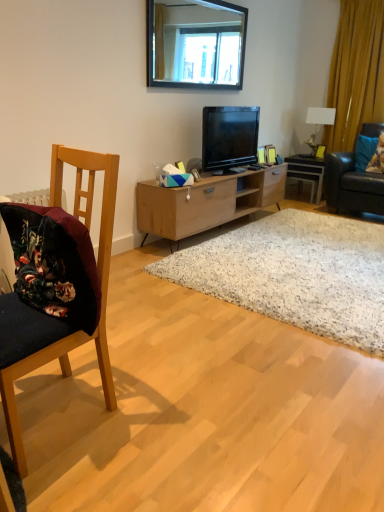
Describe the element at coordinates (295, 273) in the screenshot. The image size is (384, 512). I see `white speckled rug at center` at that location.

What do you see at coordinates (196, 44) in the screenshot? I see `black glass mirror at upper center` at bounding box center [196, 44].

What do you see at coordinates (377, 157) in the screenshot?
I see `blue fabric pillow at right, which is the 1th pillow in right-to-left order` at bounding box center [377, 157].

What do you see at coordinates (356, 72) in the screenshot?
I see `yellow fabric curtain at right` at bounding box center [356, 72].

Locate an element on the screen. The width and height of the screenshot is (384, 512). white speckled rug at center is located at coordinates [x=295, y=273].

From a real-world perspective, is light wood cabinet at center positioned above or below white speckled rug at center?

light wood cabinet at center is above white speckled rug at center.

Who is taller, light wood cabinet at center or white speckled rug at center?

Standing taller between the two is light wood cabinet at center.

From the image's perspective, is light wood cabinet at center above or below white speckled rug at center?

Based on their image positions, light wood cabinet at center is located above white speckled rug at center.

Is light wood cabinet at center facing away from white speckled rug at center?

light wood cabinet at center does not have its back to white speckled rug at center.

Does point (329, 281) lie in front of point (272, 153)?

Yes, it is.

Which of these two, white speckled rug at center or wooden picture frame at upper center, stands taller?

A: wooden picture frame at upper center.

Looking at this image, does white speckled rug at center touch wooden picture frame at upper center?

No, white speckled rug at center is not with wooden picture frame at upper center.

Can you tell me how much wooden picture frame at upper center and black leather couch at right differ in facing direction?

The facing directions of wooden picture frame at upper center and black leather couch at right are 66.4 degrees apart.

Which of these two, wooden picture frame at upper center or black leather couch at right, stands taller?

black leather couch at right is taller.

Between wooden picture frame at upper center and black leather couch at right, which one has larger width?

black leather couch at right is wider.

From the picture: In terms of width, does black glossy television at center look wider or thinner when compared to white speckled rug at center?

Clearly, black glossy television at center has less width compared to white speckled rug at center.

Based on their positions, is black glossy television at center located to the left or right of white speckled rug at center?

From the image, it's evident that black glossy television at center is to the left of white speckled rug at center.

How distant is black glossy television at center from white speckled rug at center?

A distance of 1.06 meters exists between black glossy television at center and white speckled rug at center.

In the scene shown: From a real-world perspective, is black glossy television at center positioned under white speckled rug at center based on gravity?

Incorrect, from a real-world perspective, black glossy television at center is higher than white speckled rug at center.

In the scene shown: From a real-world perspective, who is located higher, black glass mirror at upper center or blue fabric pillow at right, which is the 1th pillow in right-to-left order?

black glass mirror at upper center.

Between black glass mirror at upper center and blue fabric pillow at right, which is the 1th pillow in right-to-left order, which one has larger width?

With larger width is blue fabric pillow at right, which is the 1th pillow in right-to-left order.

Does black glass mirror at upper center turn towards blue fabric pillow at right, acting as the second pillow starting from the left?

No, black glass mirror at upper center is not aimed at blue fabric pillow at right, acting as the second pillow starting from the left.

From the image's perspective, is white speckled rug at center located beneath light wood cabinet at center?

Yes, from the image's perspective, white speckled rug at center is beneath light wood cabinet at center.

Can you confirm if white speckled rug at center is thinner than light wood cabinet at center?

In fact, white speckled rug at center might be wider than light wood cabinet at center.

How different are the orientations of white speckled rug at center and light wood cabinet at center in degrees?

The facing directions of white speckled rug at center and light wood cabinet at center are 89.7 degrees apart.

Is point (207, 250) more distant than point (141, 221)?

That is False.

From the picture: Could blue fabric pillow at right, placed as the 1th pillow when sorted from left to right, be considered to be inside black leather couch at right?

Yes, black leather couch at right is surrounding blue fabric pillow at right, placed as the 1th pillow when sorted from left to right.

From the image's perspective, which one is positioned lower, black leather couch at right or blue fabric pillow at right, the 2th pillow viewed from the right?

From the image's view, black leather couch at right is below.

Does black leather couch at right touch blue fabric pillow at right, placed as the 1th pillow when sorted from left to right?

No, black leather couch at right is not making contact with blue fabric pillow at right, placed as the 1th pillow when sorted from left to right.

From a real-world perspective, who is located lower, black leather couch at right or blue fabric pillow at right, the 2th pillow viewed from the right?

In real-world perspective, black leather couch at right is lower.

What are the coordinates of `plain in front of the light wood cabinet at center` in the screenshot? It's located at (295, 273).

Find the location of a particular element. This screenshot has width=384, height=512. plain below the wooden picture frame at upper center (from a real-world perspective) is located at coordinates (295, 273).

Looking at the image, which one is located closer to wooden desk at center, white speckled rug at center or yellow fabric curtain at right?

yellow fabric curtain at right lies closer to wooden desk at center than the other object.

Considering their positions, is black leather couch at right positioned further to white glossy lamp at upper right than velvet dark blue chair at left?

velvet dark blue chair at left lies further to white glossy lamp at upper right than the other object.

Which object lies nearer to the anchor point light wood cabinet at center, blue fabric pillow at right, acting as the second pillow starting from the left, or blue fabric pillow at right, the 2th pillow viewed from the right?

blue fabric pillow at right, the 2th pillow viewed from the right, is closer to light wood cabinet at center.

Considering their positions, is white speckled rug at center positioned closer to black leather couch at right than wooden desk at center?

Based on the image, wooden desk at center appears to be nearer to black leather couch at right.

Considering their positions, is velvet dark blue chair at left positioned further to blue fabric pillow at right, which is the 1th pillow in right-to-left order, than wooden picture frame at upper center?

velvet dark blue chair at left lies further to blue fabric pillow at right, which is the 1th pillow in right-to-left order, than the other object.

When comparing their distances from light wood cabinet at center, does blue fabric pillow at right, which is the 1th pillow in right-to-left order, or black leather couch at right seem closer?

black leather couch at right.

Considering their positions, is black glass mirror at upper center positioned closer to light wood cabinet at center than velvet dark blue chair at left?

black glass mirror at upper center.

Based on their spatial positions, is black glass mirror at upper center or blue fabric pillow at right, placed as the 1th pillow when sorted from left to right, further from white speckled rug at center?

blue fabric pillow at right, placed as the 1th pillow when sorted from left to right.

Image resolution: width=384 pixels, height=512 pixels. I want to click on studio couch between black glass mirror at upper center and blue fabric pillow at right, which is the 1th pillow in right-to-left order, in the horizontal direction, so click(351, 186).

This screenshot has width=384, height=512. Identify the location of curtain situated between black glass mirror at upper center and black leather couch at right from left to right. (356, 72).

Find the location of a particular element. cabinetry between velvet dark blue chair at left and blue fabric pillow at right, which is the 1th pillow in right-to-left order, in the front-back direction is located at coordinates [206, 202].

Locate an element on the screen. The width and height of the screenshot is (384, 512). studio couch located between white speckled rug at center and wooden picture frame at upper center in the depth direction is located at coordinates (351, 186).